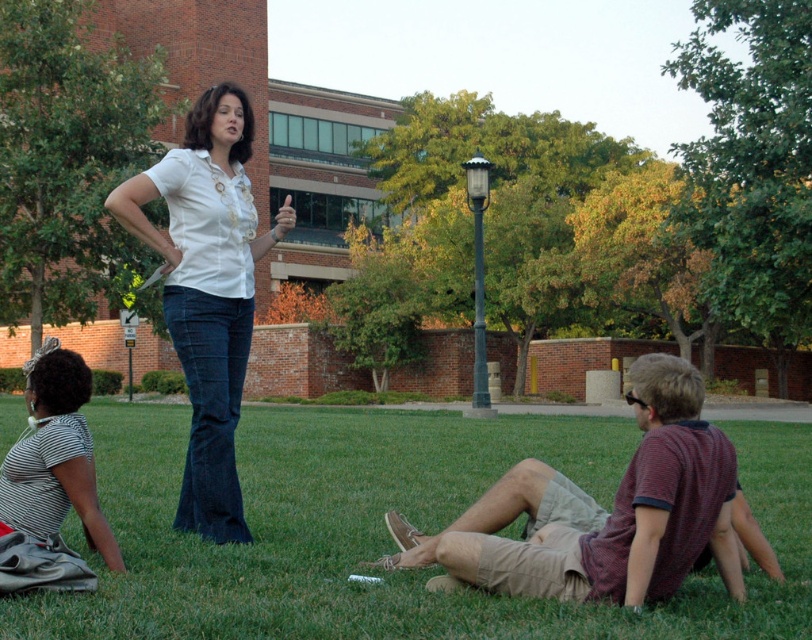
You are a photographer trying to capture a group photo of the striped cotton shirt at lower right and the white matte shirt at center. If you want to ensure both shirts are fully visible in the frame, which side should you position the wider shirt to avoid cropping?

The striped cotton shirt at lower right might be wider than the white matte shirt at center, so positioning the striped cotton shirt at lower right on the side opposite to the camera would help ensure it fits within the frame without being cropped.

You are a photographer trying to capture a group photo of the white matte shirt at center and the striped fabric shirt at lower left. Based on their positions in the image, which person should you position lower in the frame to ensure both are fully visible?

The white matte shirt at center is below striped fabric shirt at lower left, so to ensure both are fully visible, you should position the striped fabric shirt at lower left higher in the frame.

You are a photographer standing in front of the group. You want to take a photo of the striped cotton shirt at lower right and the white matte shirt at center. Which one should you focus on first to ensure both are in sharp focus?

The striped cotton shirt at lower right is closer to the viewer than the white matte shirt at center, so focus on the striped cotton shirt at lower right first to ensure both are in sharp focus.